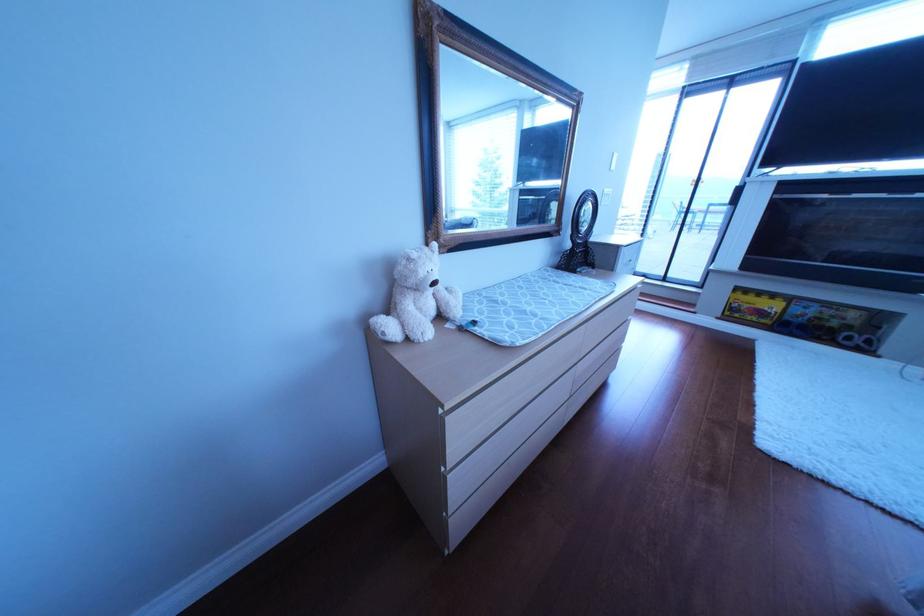
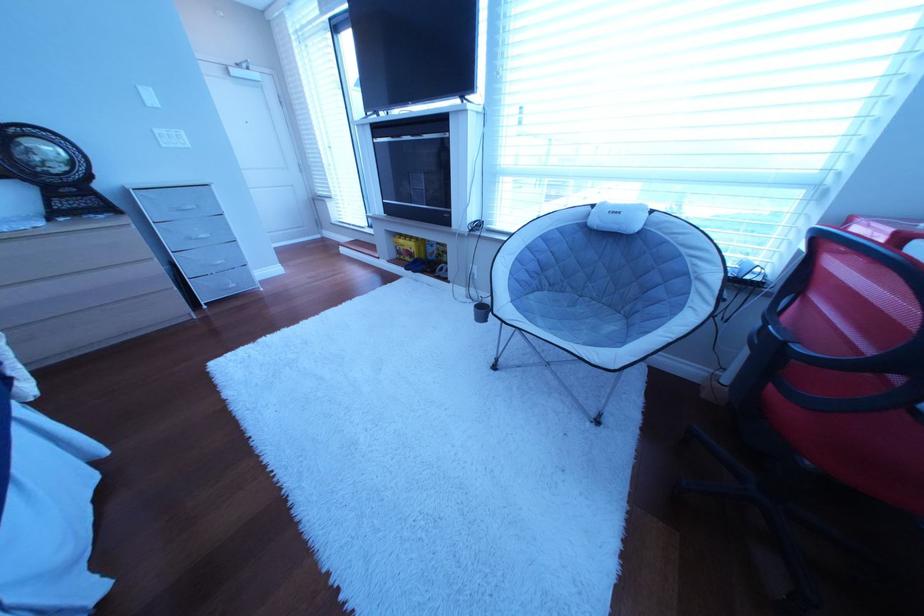
The point at (761, 308) is marked in the first image. Where is the corresponding point in the second image?

(418, 251)